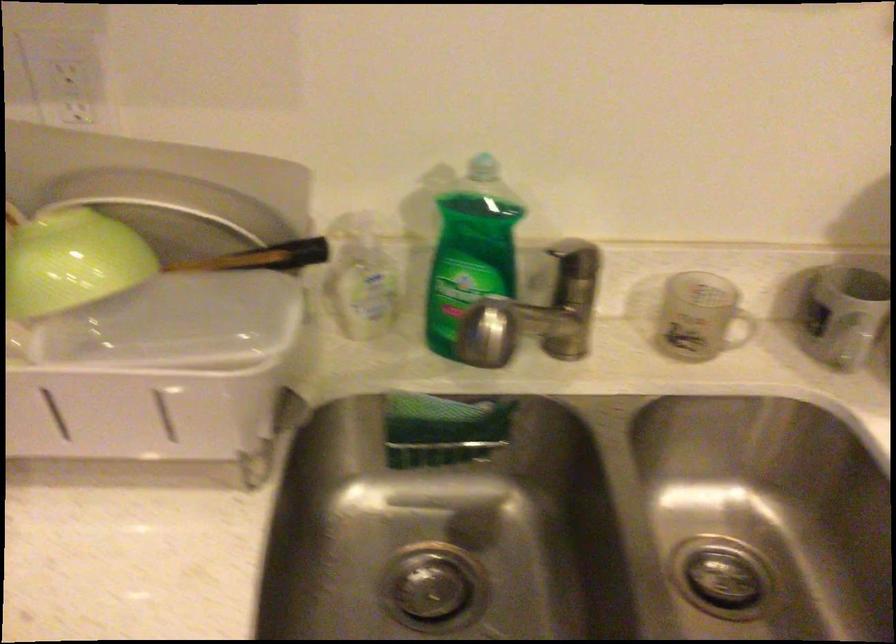
What do you see at coordinates (71, 261) in the screenshot? The width and height of the screenshot is (896, 644). I see `the green bowl` at bounding box center [71, 261].